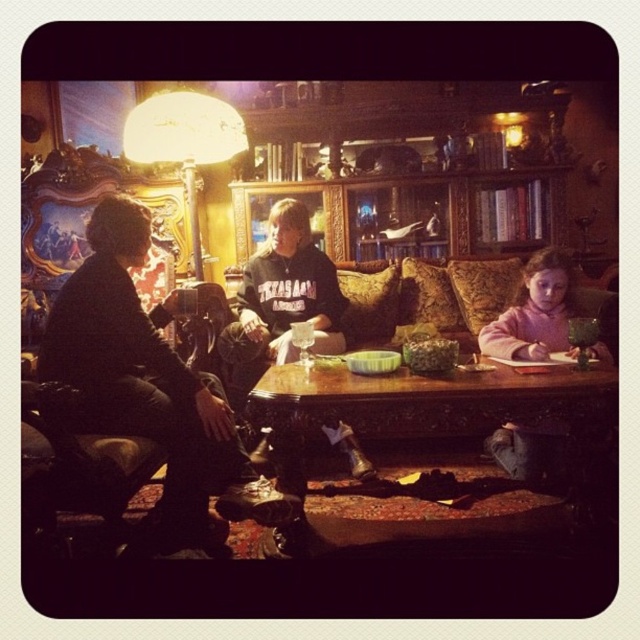
Can you confirm if dark brown leather jacket at left is positioned to the left of wooden table at center?

Correct, you'll find dark brown leather jacket at left to the left of wooden table at center.

Which is more to the right, dark brown leather jacket at left or wooden table at center?

Positioned to the right is wooden table at center.

Image resolution: width=640 pixels, height=640 pixels. What do you see at coordinates (148, 387) in the screenshot?
I see `dark brown leather jacket at left` at bounding box center [148, 387].

Locate an element on the screen. Image resolution: width=640 pixels, height=640 pixels. dark brown leather jacket at left is located at coordinates (148, 387).

What do you see at coordinates (429, 406) in the screenshot?
I see `wooden table at center` at bounding box center [429, 406].

Find the location of a particular element. wooden table at center is located at coordinates (429, 406).

Between point (381, 540) and point (224, 365), which one is positioned in front?

Point (381, 540) is in front.

This screenshot has width=640, height=640. In order to click on wooden table at center in this screenshot , I will do `click(429, 406)`.

Does point (477, 424) come in front of point (554, 429)?

No, (477, 424) is further to viewer.

Is wooden table at center smaller than pink fleece sweater at lower right?

Incorrect, wooden table at center is not smaller in size than pink fleece sweater at lower right.

What are the coordinates of `wooden table at center` in the screenshot? It's located at (429, 406).